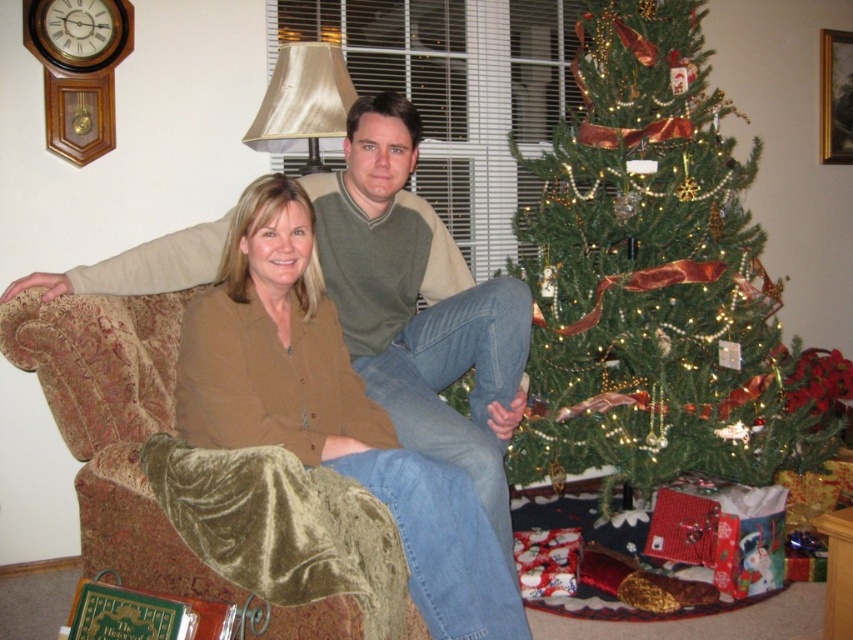
You are a photographer trying to capture a photo of the green textured christmas tree at center and the matte brown shirt at center. Which object should you focus on first if you want to ensure both are in focus, given that the tree is further away from the camera than the shirt?

The green textured christmas tree at center is taller than the matte brown shirt at center, so you should focus on the tree first to ensure both are in focus since it is taller and likely requires more depth of field.